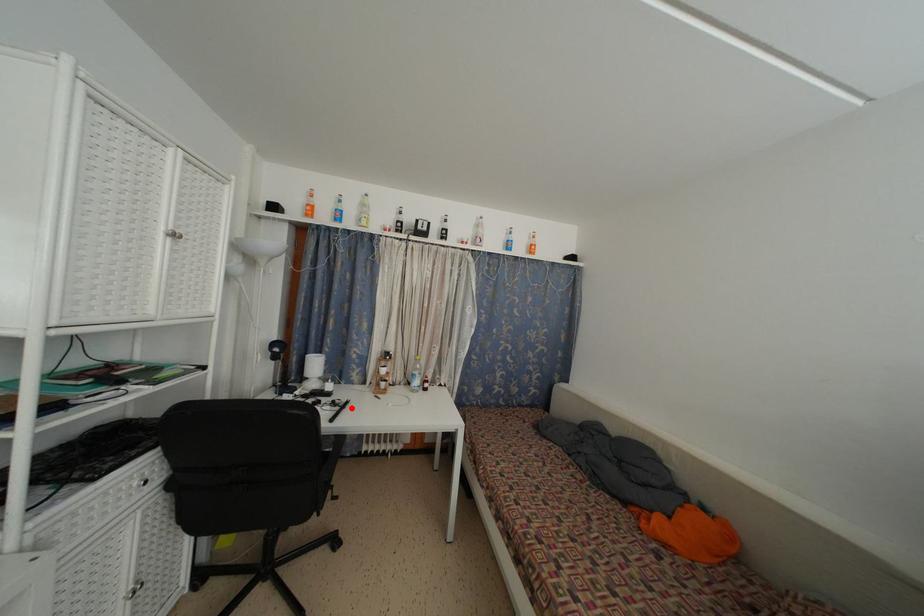
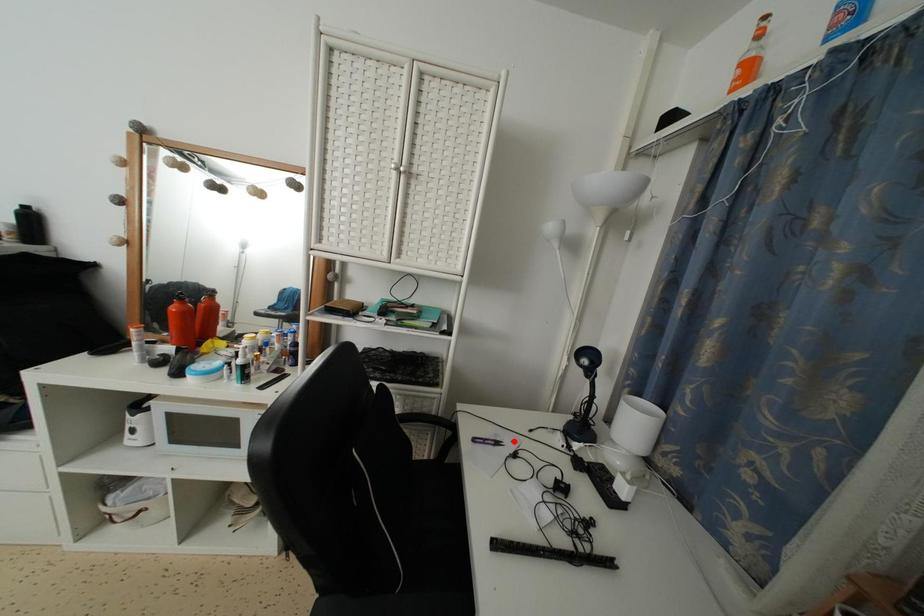
I am providing you with two images of the same scene from different viewpoints. A red point is marked on the first image and another point is marked on the second image. Are the points marked in image1 and image2 representing the same 3D position?

No